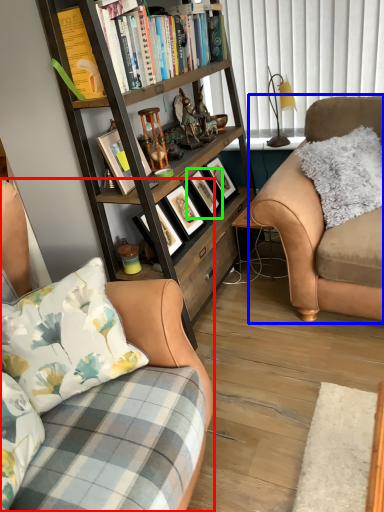
Question: Which is nearer to the studio couch (highlighted by a red box)? studio couch (highlighted by a blue box) or picture frame (highlighted by a green box).

Choices:
 (A) studio couch
 (B) picture frame

Answer: (A)